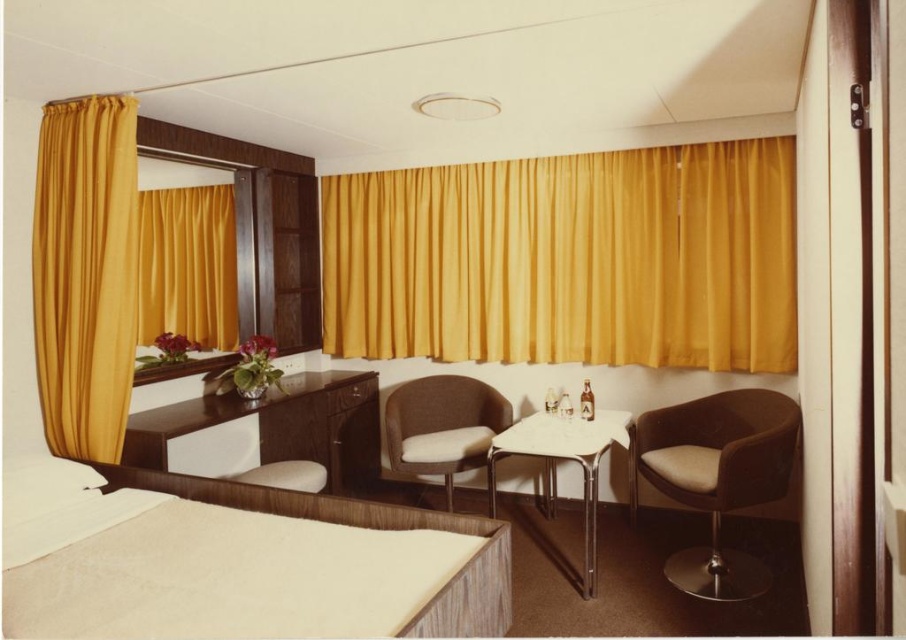
Is yellow fabric curtain at center taller than beige fabric bed at lower left?

Yes.

At what (x,y) coordinates should I click in order to perform the action: click on yellow fabric curtain at center. Please return your answer as a coordinate pair (x, y). The image size is (906, 640). Looking at the image, I should click on (567, 259).

Describe the element at coordinates (267, 429) in the screenshot. I see `matte black desk at center` at that location.

Between matte black desk at center and matte yellow curtain at left, which one is positioned lower?

Positioned lower is matte black desk at center.

Is point (323, 449) positioned behind point (229, 326)?

Yes, point (323, 449) is behind point (229, 326).

Locate an element on the screen. Image resolution: width=906 pixels, height=640 pixels. matte black desk at center is located at coordinates (267, 429).

Which is more to the right, matte yellow curtain at left or matte brown armchair at center?

matte brown armchair at center

Which of these two, matte yellow curtain at left or matte brown armchair at center, stands taller?

matte yellow curtain at left is taller.

Identify the location of matte yellow curtain at left. tap(188, 266).

This screenshot has height=640, width=906. I want to click on matte yellow curtain at left, so click(188, 266).